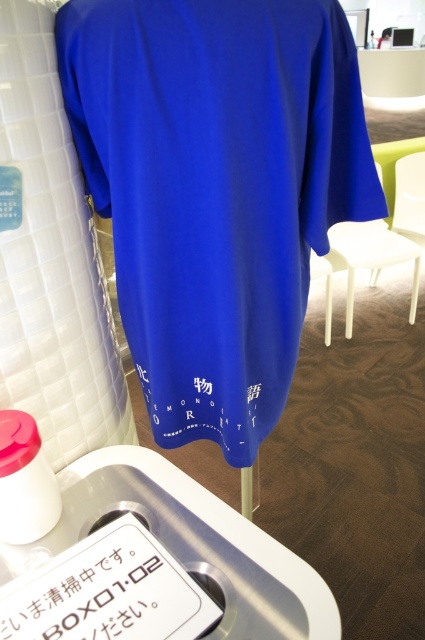
Does white plastic sink at lower left lie behind white plastic chair at right?

No, it is in front of white plastic chair at right.

Who is more forward, (198, 566) or (399, 260)?

Positioned in front is point (198, 566).

Identify the location of white plastic sink at lower left. The height and width of the screenshot is (640, 425). (189, 545).

Between matte blue t-shirt at center and white plastic sink at lower left, which one is positioned higher?

matte blue t-shirt at center

Does matte blue t-shirt at center have a smaller size compared to white plastic sink at lower left?

No.

Is point (59, 60) less distant than point (133, 456)?

Yes, it is in front of point (133, 456).

You are a GUI agent. You are given a task and a screenshot of the screen. Output one action in this format:
    pyautogui.click(x=<x>, y=<y>)
    Task: Click on the matte blue t-shirt at center
    This screenshot has width=425, height=640.
    Given the screenshot: What is the action you would take?
    pyautogui.click(x=215, y=189)

Is white plastic sink at lower left to the right of white paper at lower center from the viewer's perspective?

Yes, white plastic sink at lower left is to the right of white paper at lower center.

Does white plastic sink at lower left appear under white paper at lower center?

Actually, white plastic sink at lower left is above white paper at lower center.

Identify the location of white plastic sink at lower left. This screenshot has height=640, width=425. (189, 545).